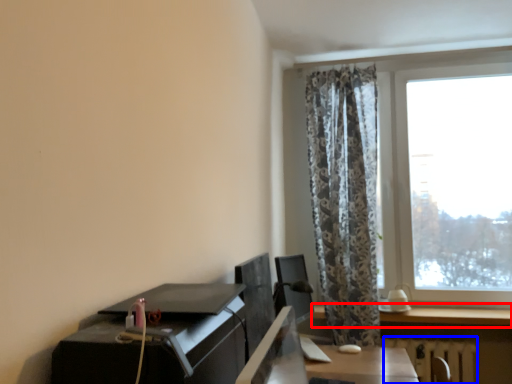
Question: Which object is closer to the camera taking this photo, window (highlighted by a red box) or radiator (highlighted by a blue box)?

Choices:
 (A) window
 (B) radiator

Answer: (A)